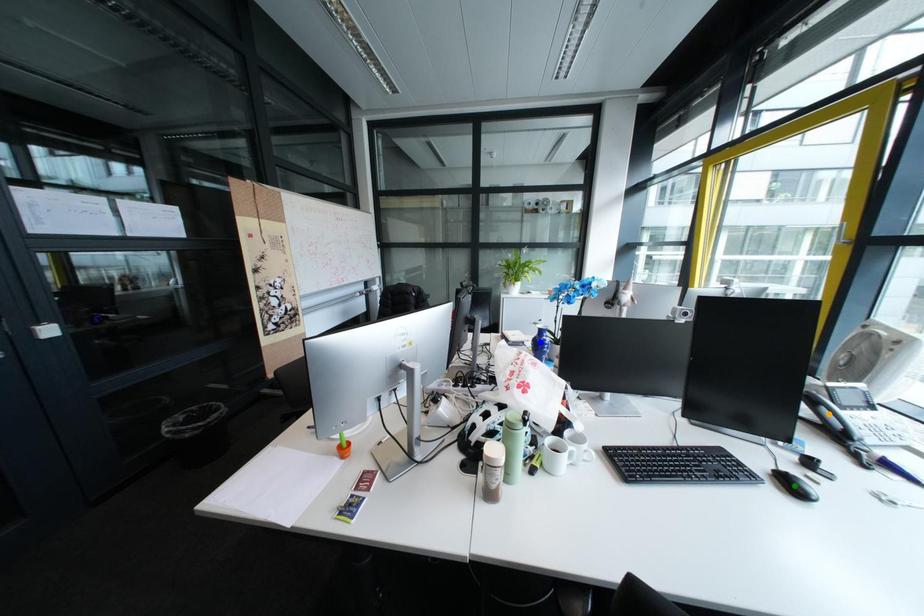
Order these from farthest to nearest:
A) orange point
B) blue point
C) green point

blue point, orange point, green point